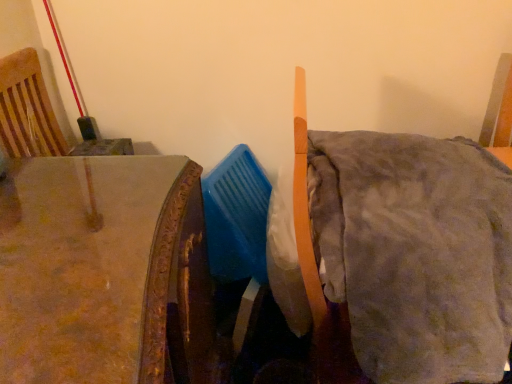
What do you see at coordinates (315, 267) in the screenshot? The width and height of the screenshot is (512, 384). I see `velvety gray blanket at upper right` at bounding box center [315, 267].

In order to face velvety gray blanket at upper right, should I rotate leftwards or rightwards?

Turn right approximately 18.577 degrees to face it.

The width and height of the screenshot is (512, 384). Find the location of `velvety gray blanket at upper right`. velvety gray blanket at upper right is located at coordinates (315, 267).

Locate an element on the screen. velvety gray blanket at upper right is located at coordinates (315, 267).